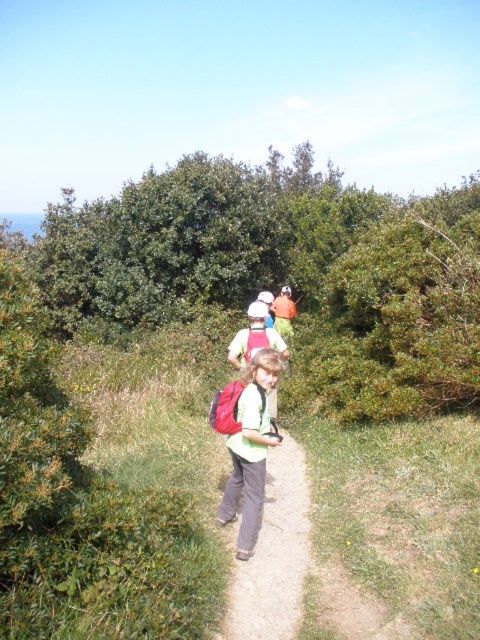
You are a photographer standing at the starting point of the hiking trail. You want to take a photo that includes both the point at coordinates point [273,488] and point [247,456]. Which point is closer to the camera so that you can ensure both are in focus?

Point [247,456] is closer to the camera than point [273,488]. To ensure both are in focus, you should focus on the point that is further away, which is point [273,488], as the depth of field will naturally include the closer point as well.

You are a hiker who wants to check the contents of your green fabric backpack at center. You also notice your matte green shirt at center. Which item is easier to reach without moving your body?

The green fabric backpack at center is closer to the viewer than the matte green shirt at center, so it is easier to reach without moving your body.

You are a hiker trying to fit your green fabric backpack at center and matte green shirt at center into a storage compartment. The compartment can only accommodate items that are narrower than the shirt. Will both items fit?

The green fabric backpack at center is wider than the matte green shirt at center. Since the backpack is wider, it won